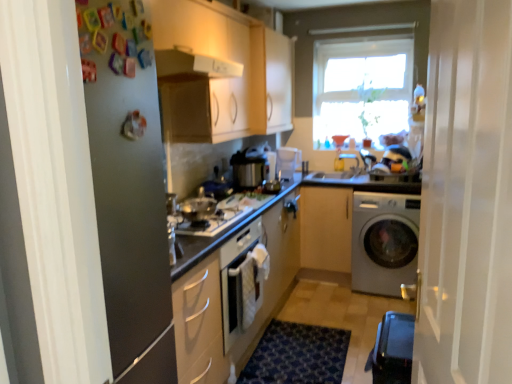
Question: From the image's perspective, would you say matte wood cabinet at upper center, which is the 2th cabinetry in right-to-left order, is positioned over transparent glass window at upper center?

Choices:
 (A) no
 (B) yes

Answer: (B)

Question: Is matte wood cabinet at upper center, the 2th cabinetry positioned from the left, oriented towards transparent glass window at upper center?

Choices:
 (A) no
 (B) yes

Answer: (B)

Question: Does matte wood cabinet at upper center, the 2th cabinetry positioned from the left, have a larger size compared to transparent glass window at upper center?

Choices:
 (A) yes
 (B) no

Answer: (A)

Question: Can you confirm if matte wood cabinet at upper center, the 2th cabinetry positioned from the left, is wider than transparent glass window at upper center?

Choices:
 (A) no
 (B) yes

Answer: (B)

Question: From the image's perspective, is matte wood cabinet at upper center, which is the 2th cabinetry in right-to-left order, beneath transparent glass window at upper center?

Choices:
 (A) no
 (B) yes

Answer: (A)

Question: Is point (408, 367) closer or farther from the camera than point (186, 201)?

Choices:
 (A) farther
 (B) closer

Answer: (B)

Question: From a real-world perspective, relative to satin silver cooker at center, arranged as the first appliance when ordered from the bottom, is black plastic water heater at lower right vertically above or below?

Choices:
 (A) above
 (B) below

Answer: (B)

Question: Based on their sizes in the image, would you say black plastic water heater at lower right is bigger or smaller than satin silver cooker at center, which appears as the 1th appliance when viewed from the front?

Choices:
 (A) big
 (B) small

Answer: (A)

Question: Considering the relative positions of black plastic water heater at lower right and satin silver cooker at center, which is counted as the second appliance, starting from the back, in the image provided, is black plastic water heater at lower right to the left or to the right of satin silver cooker at center, which is counted as the second appliance, starting from the back,?

Choices:
 (A) right
 (B) left

Answer: (A)

Question: Looking at their shapes, would you say smooth granite countertop at center is wider or thinner than satin silver washing machine at lower right?

Choices:
 (A) thin
 (B) wide

Answer: (A)

Question: In terms of size, does smooth granite countertop at center appear bigger or smaller than satin silver washing machine at lower right?

Choices:
 (A) small
 (B) big

Answer: (A)

Question: From a real-world perspective, relative to satin silver washing machine at lower right, is smooth granite countertop at center vertically above or below?

Choices:
 (A) below
 (B) above

Answer: (B)

Question: Considering their positions, is smooth granite countertop at center located in front of or behind satin silver washing machine at lower right?

Choices:
 (A) behind
 (B) front

Answer: (A)

Question: Is matte white container at center, positioned as the 1th appliance in right-to-left order, taller or shorter than shiny silver gas stove at center?

Choices:
 (A) tall
 (B) short

Answer: (A)

Question: Looking at their shapes, would you say matte white container at center, which ranks as the second appliance in front-to-back order, is wider or thinner than shiny silver gas stove at center?

Choices:
 (A) thin
 (B) wide

Answer: (A)